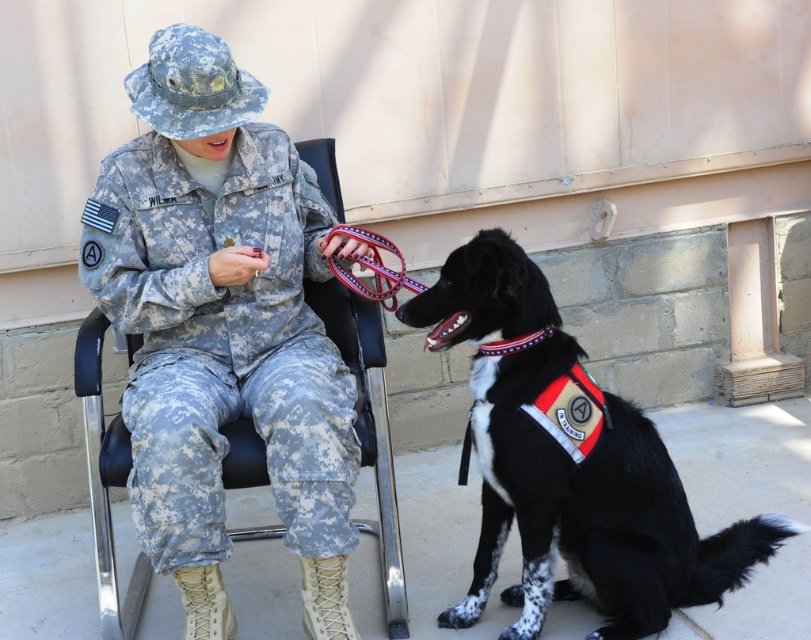
Question: Is black/white fur vest at lower right below black leather chair at center?

Choices:
 (A) no
 (B) yes

Answer: (B)

Question: Is black/white fur vest at lower right below black leather chair at center?

Choices:
 (A) no
 (B) yes

Answer: (B)

Question: Which point is farther to the camera?

Choices:
 (A) black/white fur vest at lower right
 (B) black leather chair at center

Answer: (B)

Question: Can you confirm if black/white fur vest at lower right is wider than black leather chair at center?

Choices:
 (A) no
 (B) yes

Answer: (B)

Question: Which object is farther from the camera taking this photo?

Choices:
 (A) black leather chair at center
 (B) black/white fur vest at lower right

Answer: (A)